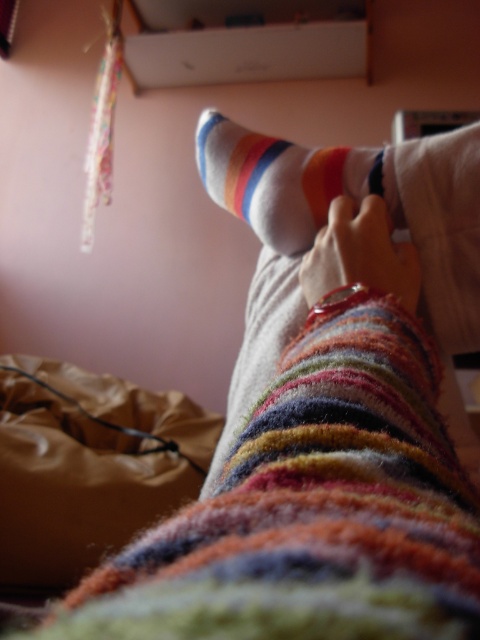
Who is more forward, (x=240, y=205) or (x=332, y=212)?

Positioned in front is point (x=332, y=212).

Image resolution: width=480 pixels, height=640 pixels. What are the coordinates of `white striped sock at center` in the screenshot? It's located at (277, 179).

Can you confirm if white striped sock at center is bigger than multicolored fuzzy socks at center?

Indeed, white striped sock at center has a larger size compared to multicolored fuzzy socks at center.

Does white striped sock at center have a greater height compared to multicolored fuzzy socks at center?

Indeed, white striped sock at center has a greater height compared to multicolored fuzzy socks at center.

Where is `white striped sock at center`? white striped sock at center is located at coordinates (277, 179).

This screenshot has width=480, height=640. Describe the element at coordinates (360, 253) in the screenshot. I see `multicolored fuzzy socks at center` at that location.

Does multicolored fuzzy socks at center come behind matte striped sock at center?

No, it is in front of matte striped sock at center.

Locate an element on the screen. This screenshot has height=640, width=480. multicolored fuzzy socks at center is located at coordinates (360, 253).

I want to click on multicolored fuzzy socks at center, so click(360, 253).